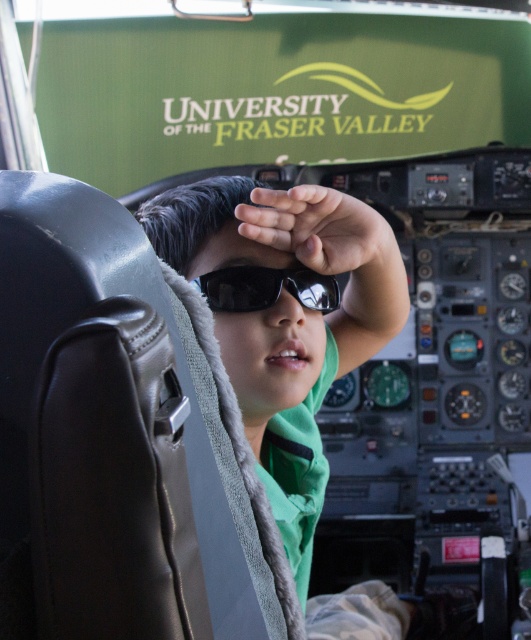
Does point (278, 413) lie behind point (237, 273)?

Yes, point (278, 413) is behind point (237, 273).

Between point (172, 200) and point (244, 273), which one is positioned in front?

Point (244, 273)

Which is behind, point (252, 422) or point (321, 298)?

Positioned behind is point (321, 298).

The height and width of the screenshot is (640, 531). In order to click on green fabric at center in this screenshot , I will do `click(285, 316)`.